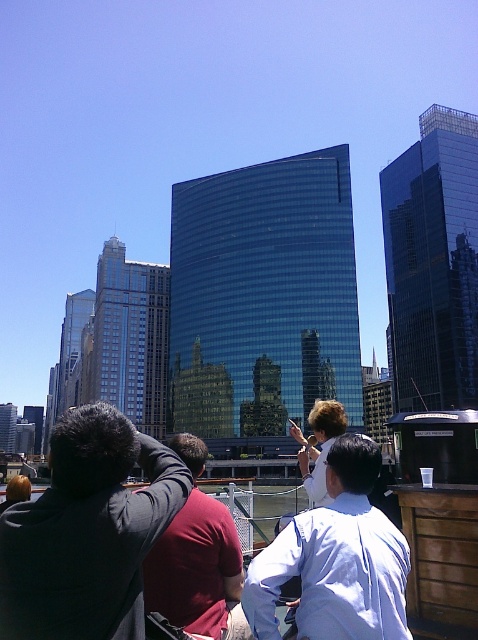
Based on the photo, which of these two, black fabric jacket at center or red shirt at center, stands shorter?

With less height is red shirt at center.

Measure the distance between black fabric jacket at center and camera.

black fabric jacket at center is 21.39 meters from camera.

You are a GUI agent. You are given a task and a screenshot of the screen. Output one action in this format:
    pyautogui.click(x=<x>, y=<y>)
    Task: Click on the black fabric jacket at center
    
    Given the screenshot: What is the action you would take?
    pyautogui.click(x=87, y=532)

Which of these two, light blue shirt at center or red shirt at center, stands taller?

red shirt at center

Is point (384, 605) farther from camera compared to point (188, 458)?

No, (384, 605) is closer to viewer.

Who is more distant from viewer, (272, 563) or (152, 564)?

Positioned behind is point (152, 564).

Locate an element on the screen. light blue shirt at center is located at coordinates (336, 560).

From the picture: Which is above, black fabric jacket at center or blonde hair at lower left?

black fabric jacket at center is higher up.

Which is behind, point (31, 595) or point (20, 492)?

Point (20, 492)

Where is `black fabric jacket at center`? The image size is (478, 640). black fabric jacket at center is located at coordinates pos(87,532).